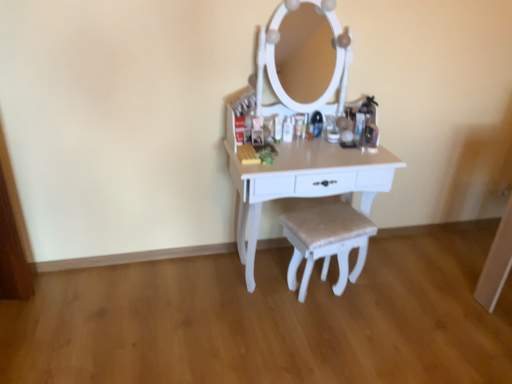
Locate an element on the screen. The height and width of the screenshot is (384, 512). vacant space in front of beige fabric stool at center is located at coordinates click(x=330, y=339).